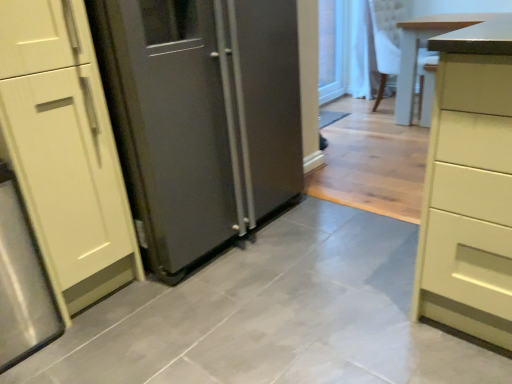
What do you see at coordinates (332, 49) in the screenshot? This screenshot has width=512, height=384. I see `transparent glass door at upper right` at bounding box center [332, 49].

Image resolution: width=512 pixels, height=384 pixels. What do you see at coordinates (418, 49) in the screenshot?
I see `light wood table at right` at bounding box center [418, 49].

You are a GUI agent. You are given a task and a screenshot of the screen. Output one action in this format:
    pyautogui.click(x=<x>, y=<y>)
    Task: Click on the satin silver refrigerator at center
    
    Given the screenshot: What is the action you would take?
    pyautogui.click(x=202, y=117)

The width and height of the screenshot is (512, 384). I want to click on transparent glass door at upper right, so click(x=332, y=49).

Does satin silver refrigerator at center have a greater width compared to light wood table at right?

No.

Does satin silver refrigerator at center have a greater height compared to light wood table at right?

Yes, satin silver refrigerator at center is taller than light wood table at right.

Can we say satin silver refrigerator at center lies outside light wood table at right?

satin silver refrigerator at center is positioned outside light wood table at right.

Considering the positions of objects satin silver refrigerator at center and light wood table at right in the image provided, who is more to the right, satin silver refrigerator at center or light wood table at right?

From the viewer's perspective, light wood table at right appears more on the right side.

Is light wood table at right shorter than satin silver refrigerator at center?

Correct, light wood table at right is not as tall as satin silver refrigerator at center.

Is light wood table at right positioned with its back to satin silver refrigerator at center?

No, satin silver refrigerator at center is not at the back of light wood table at right.

Considering the relative sizes of light wood table at right and satin silver refrigerator at center in the image provided, is light wood table at right bigger than satin silver refrigerator at center?

Incorrect, light wood table at right is not larger than satin silver refrigerator at center.

Locate an element on the screen. This screenshot has height=384, width=512. door that appears in front of the light wood table at right is located at coordinates (202, 117).

Which object is closer to the camera, light wood table at right or transparent glass door at upper right?

light wood table at right is more forward.

From a real-world perspective, is light wood table at right above or below transparent glass door at upper right?

From a real-world perspective, light wood table at right is physically below transparent glass door at upper right.

Is light wood table at right not within transparent glass door at upper right?

Yes, light wood table at right is not within transparent glass door at upper right.

Considering the sizes of light wood table at right and transparent glass door at upper right in the image, is light wood table at right bigger or smaller than transparent glass door at upper right?

Clearly, light wood table at right is larger in size than transparent glass door at upper right.

From the image's perspective, is transparent glass door at upper right on top of satin silver refrigerator at center?

Yes, from the image's perspective, transparent glass door at upper right is above satin silver refrigerator at center.

From a real-world perspective, is transparent glass door at upper right over satin silver refrigerator at center?

No, from a real-world perspective, transparent glass door at upper right is not above satin silver refrigerator at center.

Consider the image. Is transparent glass door at upper right beside satin silver refrigerator at center?

No, transparent glass door at upper right is not next to satin silver refrigerator at center.

Is transparent glass door at upper right shorter than satin silver refrigerator at center?

Indeed, transparent glass door at upper right has a lesser height compared to satin silver refrigerator at center.

Is point (170, 151) closer to viewer compared to point (337, 3)?

Yes, point (170, 151) is closer to viewer.

Does satin silver refrigerator at center have a larger size compared to transparent glass door at upper right?

Yes.

Looking at this image, is there a large distance between satin silver refrigerator at center and transparent glass door at upper right?

Indeed, satin silver refrigerator at center is not near transparent glass door at upper right.

From a real-world perspective, is satin silver refrigerator at center positioned under transparent glass door at upper right based on gravity?

Actually, satin silver refrigerator at center is physically above transparent glass door at upper right in the real world.

Visually, is transparent glass door at upper right positioned to the left or to the right of light wood table at right?

Based on their positions, transparent glass door at upper right is located to the left of light wood table at right.

Considering the positions of objects transparent glass door at upper right and light wood table at right in the image provided, who is behind, transparent glass door at upper right or light wood table at right?

transparent glass door at upper right is behind.

Locate an element on the screen. table that is below the transparent glass door at upper right (from the image's perspective) is located at coordinates (418, 49).

Is transparent glass door at upper right not near light wood table at right?

Yes, transparent glass door at upper right and light wood table at right are located far from each other.

Image resolution: width=512 pixels, height=384 pixels. Find the location of `door to the left of light wood table at right`. door to the left of light wood table at right is located at coordinates (202, 117).

Locate an element on the screen. This screenshot has width=512, height=384. door in front of the light wood table at right is located at coordinates (202, 117).

Based on their spatial positions, is light wood table at right or satin silver refrigerator at center closer to transparent glass door at upper right?

light wood table at right is positioned closer to the anchor transparent glass door at upper right.

When comparing their distances from light wood table at right, does transparent glass door at upper right or satin silver refrigerator at center seem closer?

Based on the image, transparent glass door at upper right appears to be nearer to light wood table at right.

Looking at the image, which one is located further to satin silver refrigerator at center, transparent glass door at upper right or light wood table at right?

Based on the image, transparent glass door at upper right appears to be further to satin silver refrigerator at center.

Looking at this image, when comparing their distances from satin silver refrigerator at center, does light wood table at right or transparent glass door at upper right seem further?

Among the two, transparent glass door at upper right is located further to satin silver refrigerator at center.

From the image, which object appears to be farther from light wood table at right, satin silver refrigerator at center or transparent glass door at upper right?

satin silver refrigerator at center is further to light wood table at right.

When comparing their distances from transparent glass door at upper right, does satin silver refrigerator at center or light wood table at right seem further?

satin silver refrigerator at center is further to transparent glass door at upper right.

Find the location of a particular element. This screenshot has height=384, width=512. table positioned between satin silver refrigerator at center and transparent glass door at upper right from near to far is located at coordinates click(x=418, y=49).